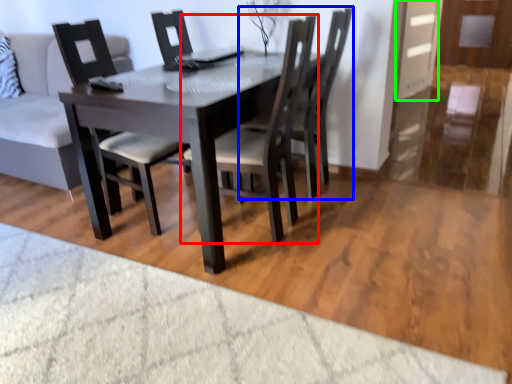
Question: Estimate the real-world distances between objects in this image. Which object is farther from chair (highlighted by a red box), chair (highlighted by a blue box) or glass door (highlighted by a green box)?

Choices:
 (A) chair
 (B) glass door

Answer: (B)